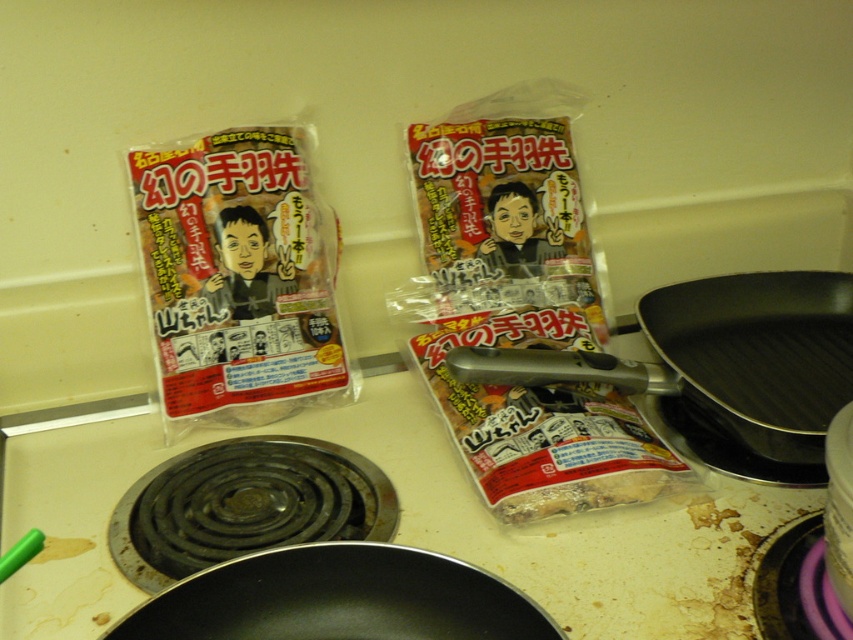
You are a chef standing in front of the kitchen countertop. You need to place a new ingredient between the two points marked as point (242, 145) and point (328, 620). Which point should you place it closer to if you want the ingredient to be closer to the viewer?

You should place the ingredient closer to point (242, 145) because it is closer to the viewer compared to point (328, 620).